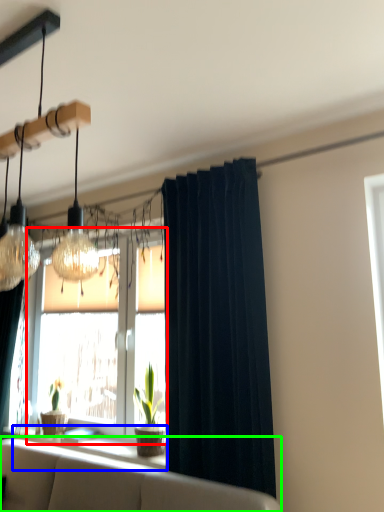
Question: Considering the real-world distances, which object is closest to window (highlighted by a red box)? window sill (highlighted by a blue box) or studio couch (highlighted by a green box).

Choices:
 (A) window sill
 (B) studio couch

Answer: (A)